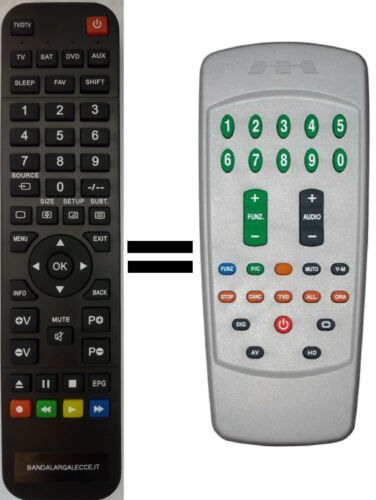
Find the location of a particular element. The width and height of the screenshot is (376, 500). corner of grey remote is located at coordinates (219, 436), (350, 434), (361, 56), (205, 58).